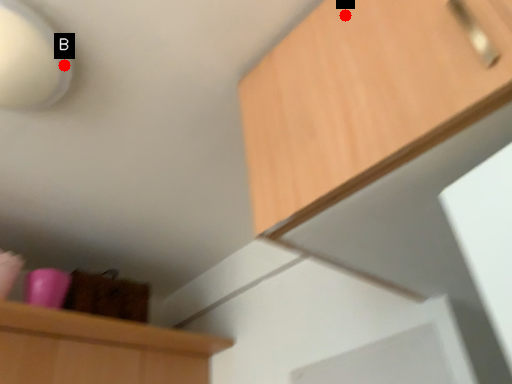
Question: Two points are circled on the image, labeled by A and B beside each circle. Which point appears closest to the camera in this image?

Choices:
 (A) A is closer
 (B) B is closer

Answer: (A)